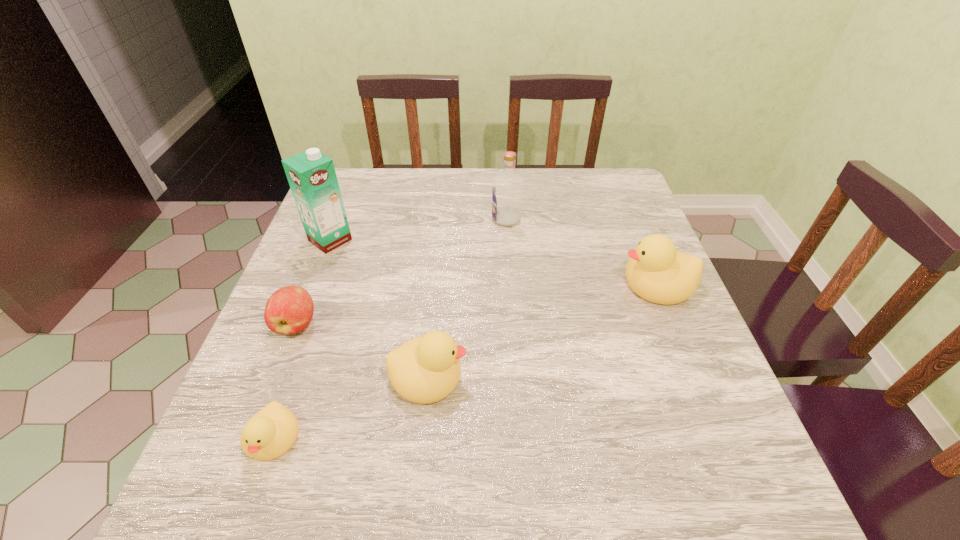
Identify the location of duckling that is at the left edge. Image resolution: width=960 pixels, height=540 pixels. 271,432.

Identify the location of carton that is at the left edge. (311, 175).

You are a GUI agent. You are given a task and a screenshot of the screen. Output one action in this format:
    pyautogui.click(x=<x>, y=<y>)
    Task: Click on the apple that is at the left edge
    The image size is (960, 540).
    Given the screenshot: What is the action you would take?
    pyautogui.click(x=289, y=310)

Locate an element on the screen. This screenshot has width=960, height=540. object that is at the right edge is located at coordinates (656, 271).

The image size is (960, 540). What are the coordinates of `object positioned at the near left corner` in the screenshot? It's located at (271, 432).

In order to click on vacant space at the far edge of the desktop in this screenshot , I will do `click(579, 208)`.

Where is `vacant space at the right edge of the desktop`? vacant space at the right edge of the desktop is located at coordinates (613, 239).

This screenshot has width=960, height=540. Find the location of `free space at the far right corner of the desktop`. free space at the far right corner of the desktop is located at coordinates (632, 187).

This screenshot has width=960, height=540. Find the location of `empty location between the rightmost duckling and the fifth object from left to right`. empty location between the rightmost duckling and the fifth object from left to right is located at coordinates (582, 251).

This screenshot has height=540, width=960. What are the coordinates of `blank region between the nearest object and the second duckling from left to right` in the screenshot? It's located at (350, 407).